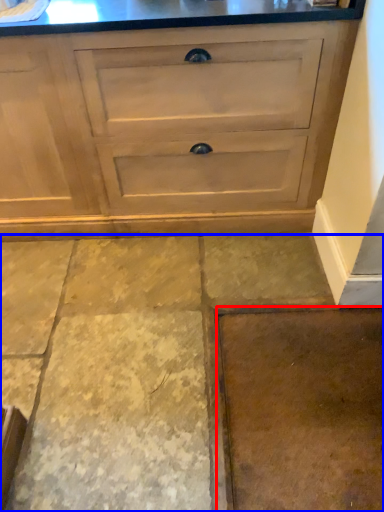
Question: Which object is further to the camera taking this photo, concrete (highlighted by a red box) or concrete (highlighted by a blue box)?

Choices:
 (A) concrete
 (B) concrete

Answer: (A)